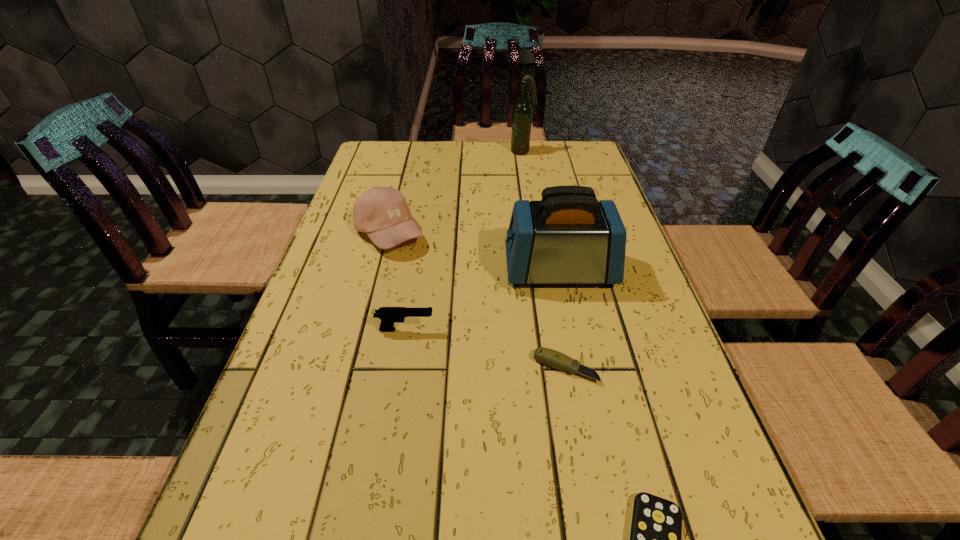
Where is `free region located 0.300m on the front-facing side of the baseball cap`? free region located 0.300m on the front-facing side of the baseball cap is located at coordinates (539, 233).

Image resolution: width=960 pixels, height=540 pixels. What are the coordinates of `vacant space situated on the front-facing side of the third nearest object` in the screenshot? It's located at (496, 330).

Locate an element on the screen. The width and height of the screenshot is (960, 540). free space located 0.220m on the front of the pocketknife is located at coordinates (589, 511).

This screenshot has width=960, height=540. In order to click on object present at the far edge in this screenshot , I will do `click(522, 111)`.

This screenshot has width=960, height=540. In order to click on object at the left edge in this screenshot , I will do `click(382, 213)`.

I want to click on object that is at the right edge, so click(568, 237).

You are a GUI agent. You are given a task and a screenshot of the screen. Output one action in this format:
    pyautogui.click(x=<x>, y=<y>)
    Task: Click on the vacant region at the far edge of the desktop
    This screenshot has width=960, height=540.
    Given the screenshot: What is the action you would take?
    pyautogui.click(x=435, y=160)

At what (x,y) coordinates should I click in order to perform the action: click on free space at the left edge of the desktop. Please return your answer as a coordinate pair (x, y). Looking at the image, I should click on (353, 207).

Where is `free location at the right edge`? The image size is (960, 540). free location at the right edge is located at coordinates (640, 267).

Where is `blank space at the far right corner of the desktop`? The height and width of the screenshot is (540, 960). blank space at the far right corner of the desktop is located at coordinates (577, 153).